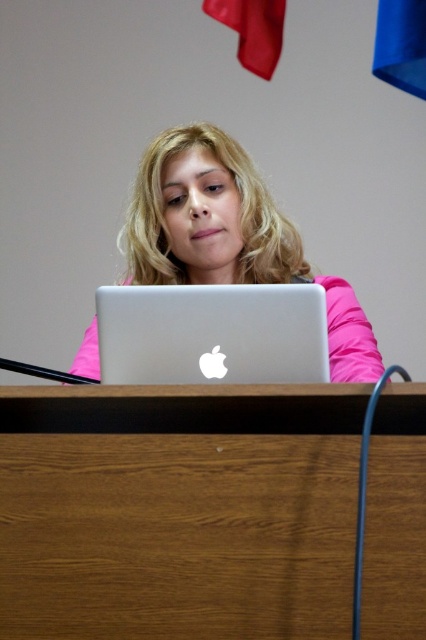
Question: Can you confirm if matte silver laptop at center is wider than silver metallic laptop at center?

Choices:
 (A) yes
 (B) no

Answer: (A)

Question: Estimate the real-world distances between objects in this image. Which object is farther from the brown wood table at center?

Choices:
 (A) silver metallic laptop at center
 (B) matte silver laptop at center

Answer: (B)

Question: Can you confirm if matte silver laptop at center is bigger than silver metallic laptop at center?

Choices:
 (A) yes
 (B) no

Answer: (A)

Question: Is brown wood table at center positioned behind silver metallic laptop at center?

Choices:
 (A) no
 (B) yes

Answer: (A)

Question: Among these objects, which one is nearest to the camera?

Choices:
 (A) brown wood table at center
 (B) matte silver laptop at center

Answer: (A)

Question: Which point is closer to the camera?

Choices:
 (A) brown wood table at center
 (B) matte silver laptop at center

Answer: (A)